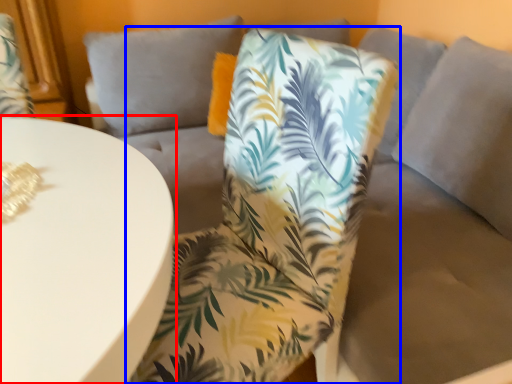
Question: Which of the following is the closest to the observer, table (highlighted by a red box) or chair (highlighted by a blue box)?

Choices:
 (A) table
 (B) chair

Answer: (A)